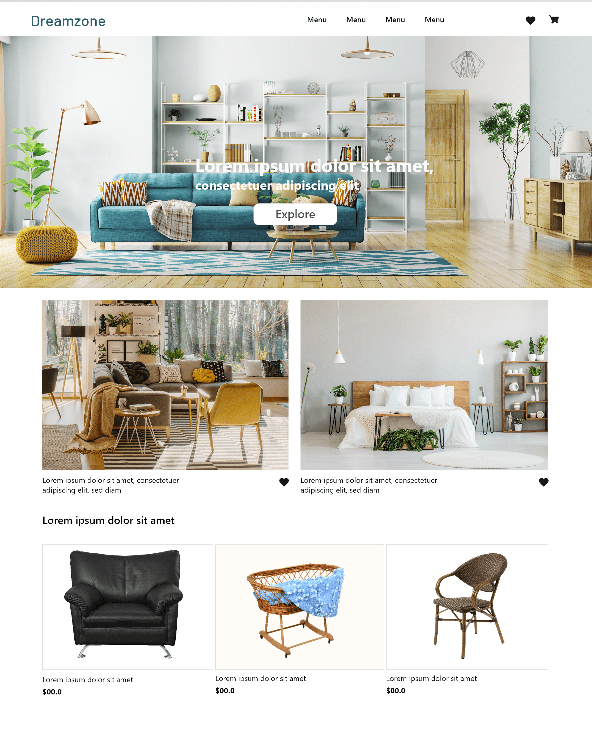
This screenshot has height=750, width=592. Find the location of `plant`. plant is located at coordinates (508, 342), (540, 345), (511, 122), (35, 160).